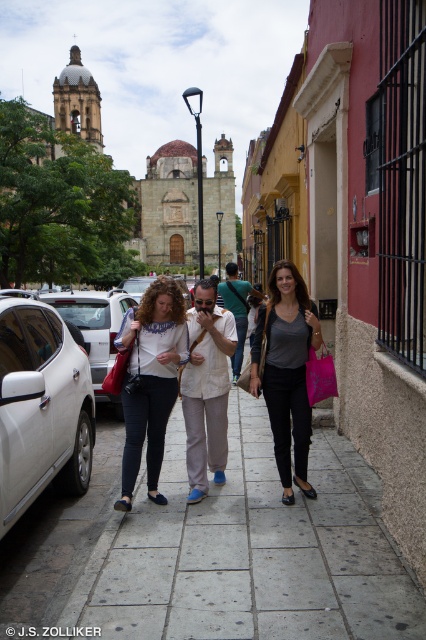
Question: Is matte white blouse at center bigger than matte gray shirt at center?

Choices:
 (A) no
 (B) yes

Answer: (B)

Question: Which point appears closest to the camera in this image?

Choices:
 (A) click(118, 515)
 (B) click(62, 417)

Answer: (A)

Question: Which point appears farthest from the camera in this image?

Choices:
 (A) (178, 321)
 (B) (14, 493)
 (C) (100, 528)
 (D) (127, 294)

Answer: (D)

Question: Does gray concrete pavement at center appear over matte white blouse at center?

Choices:
 (A) yes
 (B) no

Answer: (B)

Question: Among these points, which one is nearest to the camera?

Choices:
 (A) (163, 416)
 (B) (287, 385)

Answer: (A)

Question: Is gray concrete pavement at center closer to camera compared to white glossy car at lower left?

Choices:
 (A) no
 (B) yes

Answer: (B)